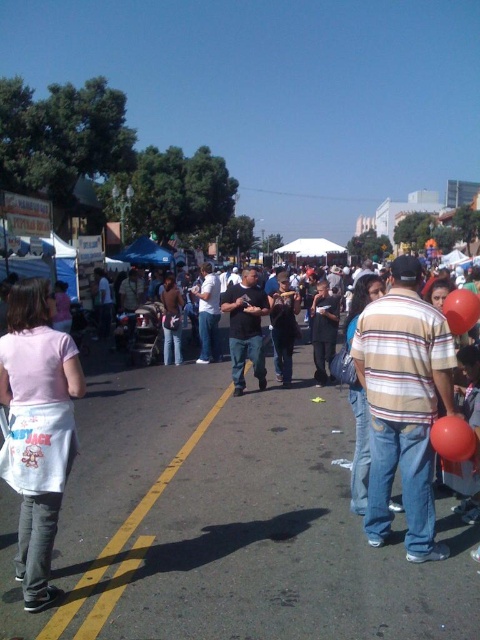
Can you confirm if white matte shirt at center is wider than rubber balloon at center right?

Yes, white matte shirt at center is wider than rubber balloon at center right.

Does point (202, 273) come in front of point (468, 317)?

No, (202, 273) is behind (468, 317).

Between point (204, 307) and point (477, 300), which one is positioned behind?

Positioned behind is point (204, 307).

Identify the location of white matte shirt at center. (207, 314).

Which is behind, point (204, 266) or point (164, 282)?

The point (164, 282) is more distant.

Is white matte shirt at center to the left of dark brown leather jacket at center from the viewer's perspective?

In fact, white matte shirt at center is to the right of dark brown leather jacket at center.

Based on the photo, who is more distant from viewer, (x=210, y=360) or (x=177, y=324)?

Point (x=210, y=360)

Find the location of a particular element. white matte shirt at center is located at coordinates (207, 314).

Which is more to the right, black matte shirt at center or red rubber balloon at lower right?

red rubber balloon at lower right

From the picture: Does black matte shirt at center lie behind red rubber balloon at lower right?

Yes, it is behind red rubber balloon at lower right.

Which is in front, point (254, 348) or point (457, 449)?

Positioned in front is point (457, 449).

In order to click on black matte shirt at center in this screenshot , I will do `click(245, 326)`.